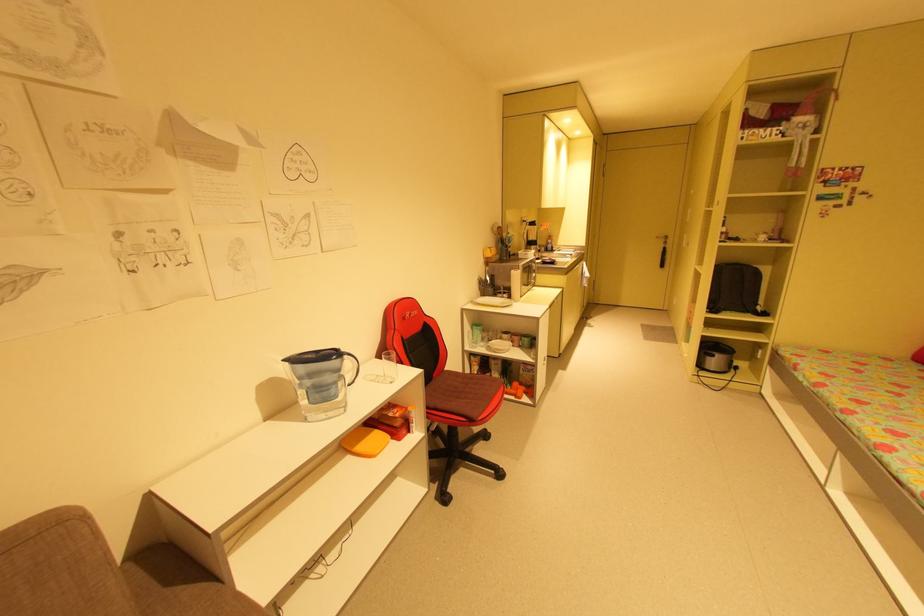
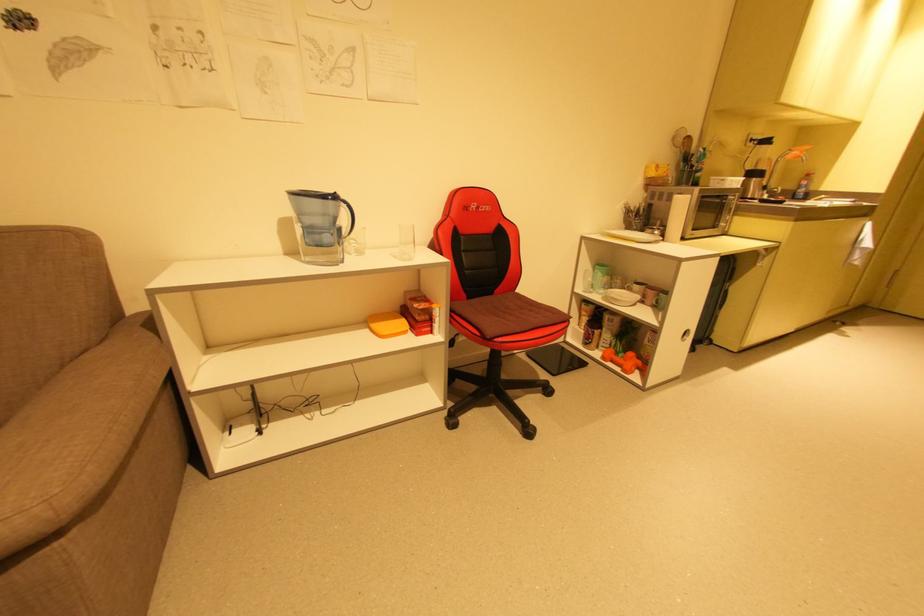
Find the pixel in the second image that matches point (348, 357) in the first image.

(346, 204)